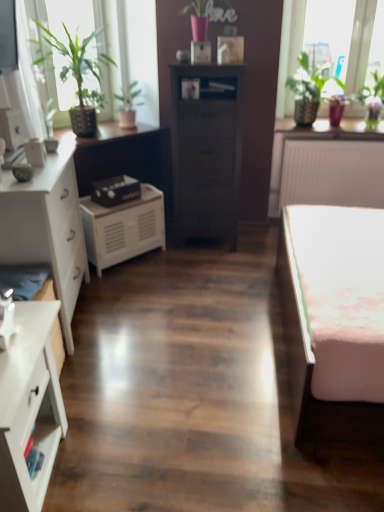
Find the location of `vacant space that is in between dark wood cabinet at center, the first chest of drawers from the right, and white glossy chest of drawers at lower left, which ranks as the 2th chest of drawers in right-to-left order`. vacant space that is in between dark wood cabinet at center, the first chest of drawers from the right, and white glossy chest of drawers at lower left, which ranks as the 2th chest of drawers in right-to-left order is located at coordinates (146, 319).